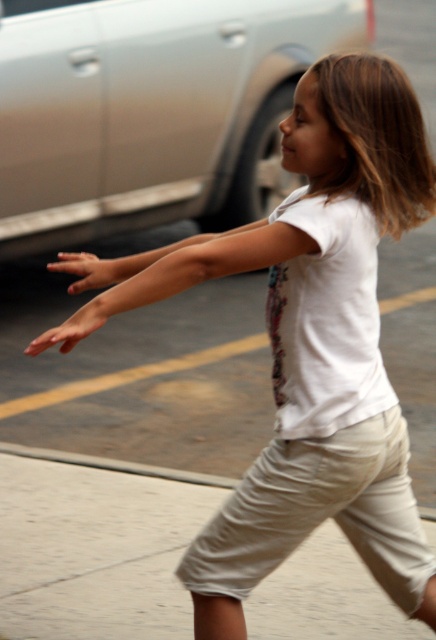
Question: Which object appears closest to the camera in this image?

Choices:
 (A) khaki cotton shorts at lower right
 (B) brushed metal car at upper left
 (C) smooth concrete curb at lower center

Answer: (A)

Question: Does khaki cotton shorts at lower right have a lesser width compared to smooth concrete curb at lower center?

Choices:
 (A) yes
 (B) no

Answer: (A)

Question: Estimate the real-world distances between objects in this image. Which object is farther from the smooth concrete curb at lower center?

Choices:
 (A) khaki cotton shorts at lower right
 (B) brushed metal car at upper left

Answer: (B)

Question: Does brushed metal car at upper left appear on the left side of smooth concrete curb at lower center?

Choices:
 (A) yes
 (B) no

Answer: (A)

Question: Can you confirm if khaki cotton shorts at lower right is bigger than smooth concrete curb at lower center?

Choices:
 (A) no
 (B) yes

Answer: (B)

Question: Which object is closer to the camera taking this photo?

Choices:
 (A) khaki cotton shorts at lower right
 (B) smooth concrete curb at lower center

Answer: (A)